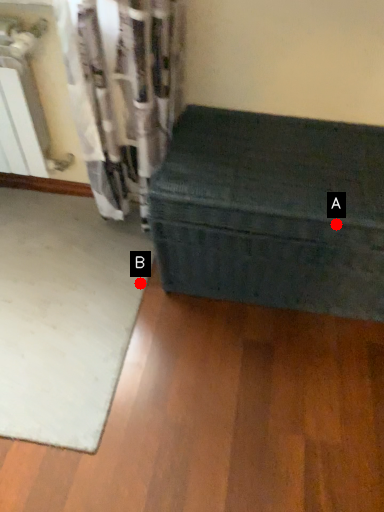
Question: Two points are circled on the image, labeled by A and B beside each circle. Which point is closer to the camera taking this photo?

Choices:
 (A) A is closer
 (B) B is closer

Answer: (A)